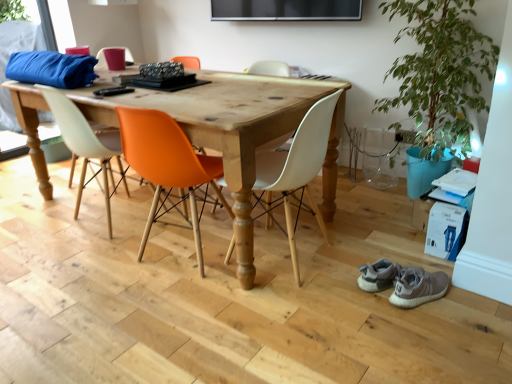
Question: Is gray suede sneakers at lower right situated inside matte orange chair at center, arranged as the second chair when viewed from the left, or outside?

Choices:
 (A) outside
 (B) inside

Answer: (A)

Question: In the image, is gray suede sneakers at lower right positioned in front of or behind matte orange chair at center, arranged as the second chair when viewed from the left?

Choices:
 (A) behind
 (B) front

Answer: (B)

Question: Which object is positioned farthest from the green leafy plant at right?

Choices:
 (A) matte orange chair at center, which is the third chair from right to left
 (B) matte plastic cup at upper left, positioned as the fourth chair in right-to-left order
 (C) orange plastic chair at center, acting as the third chair starting from the left
 (D) gray suede sneakers at lower right
 (E) white matte chair at center, arranged as the 1th chair when viewed from the right

Answer: (B)

Question: Based on their relative distances, which object is farther from the gray suede sneakers at lower right?

Choices:
 (A) matte orange chair at center, which is the third chair from right to left
 (B) matte plastic cup at upper left, positioned as the fourth chair in right-to-left order
 (C) green leafy plant at right
 (D) orange plastic chair at center, acting as the third chair starting from the left
 (E) white matte chair at center, arranged as the 1th chair when viewed from the right

Answer: (B)